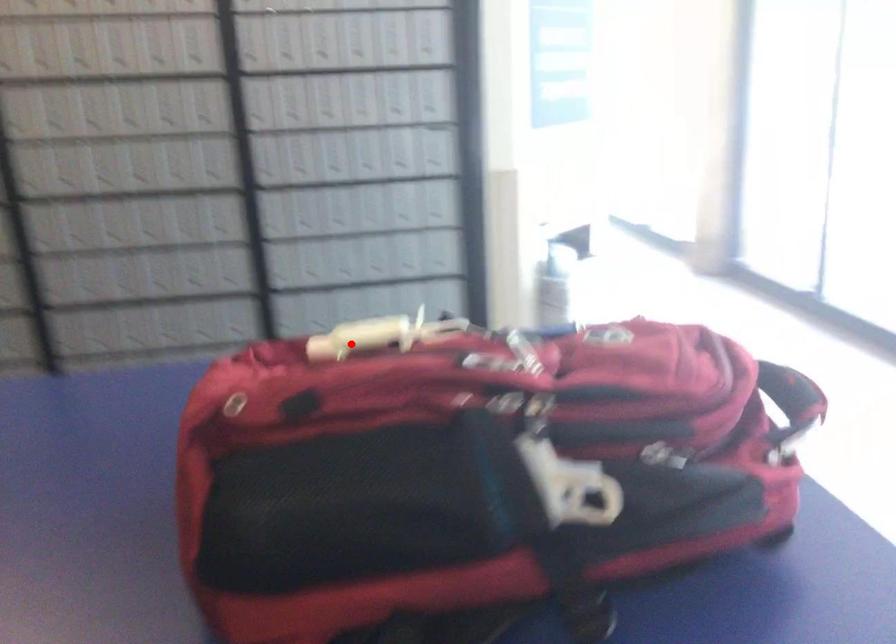
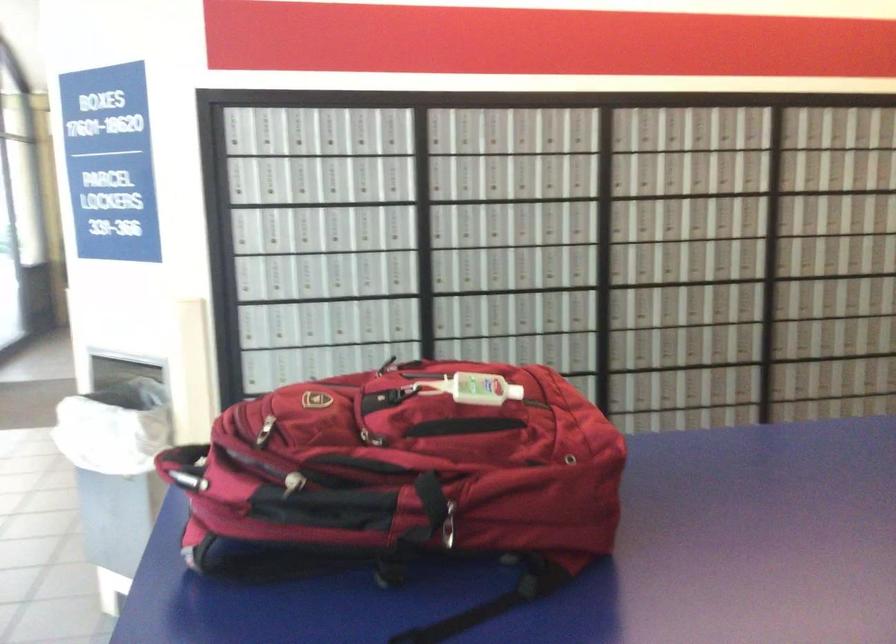
In the second image, find the point that corresponds to the highlighted location in the first image.

(471, 389)